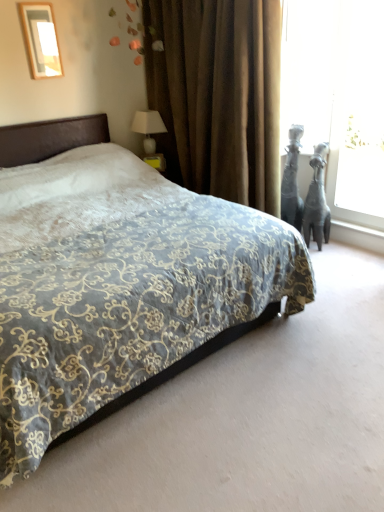
Question: Considering the relative sizes of white glossy wood at right and transparent glass window screen at right in the image provided, is white glossy wood at right shorter than transparent glass window screen at right?

Choices:
 (A) no
 (B) yes

Answer: (B)

Question: Is white glossy wood at right turned away from transparent glass window screen at right?

Choices:
 (A) yes
 (B) no

Answer: (B)

Question: From a real-world perspective, is white glossy wood at right on top of transparent glass window screen at right?

Choices:
 (A) no
 (B) yes

Answer: (A)

Question: Is white glossy wood at right outside of transparent glass window screen at right?

Choices:
 (A) yes
 (B) no

Answer: (A)

Question: Is transparent glass window screen at right completely or partially inside white glossy wood at right?

Choices:
 (A) no
 (B) yes

Answer: (A)

Question: Considering the relative sizes of white glossy wood at right and transparent glass window screen at right in the image provided, is white glossy wood at right taller than transparent glass window screen at right?

Choices:
 (A) yes
 (B) no

Answer: (B)

Question: From the image's perspective, is white glossy wood at right beneath matte black giraffe at right?

Choices:
 (A) no
 (B) yes

Answer: (B)

Question: Can you confirm if white glossy wood at right is taller than matte black giraffe at right?

Choices:
 (A) no
 (B) yes

Answer: (A)

Question: Is white glossy wood at right outside matte black giraffe at right?

Choices:
 (A) yes
 (B) no

Answer: (A)

Question: Does white glossy wood at right have a lesser height compared to matte black giraffe at right?

Choices:
 (A) no
 (B) yes

Answer: (B)

Question: Does white glossy wood at right touch matte black giraffe at right?

Choices:
 (A) no
 (B) yes

Answer: (A)

Question: Is matte black giraffe at right completely or partially inside white glossy wood at right?

Choices:
 (A) yes
 (B) no

Answer: (B)

Question: Is white glossy table lamp at upper right beside velvet-patterned bed at center?

Choices:
 (A) no
 (B) yes

Answer: (A)